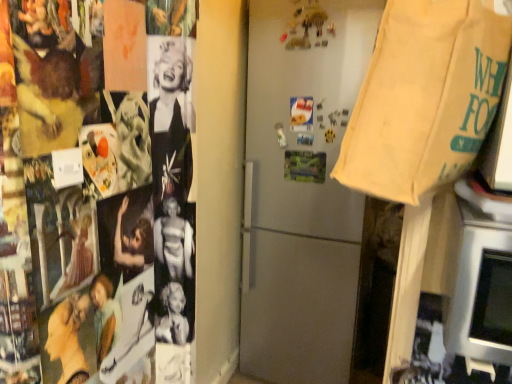
This screenshot has height=384, width=512. Describe the element at coordinates (425, 97) in the screenshot. I see `beige canvas grocery bag at upper right` at that location.

The image size is (512, 384). What do you see at coordinates (302, 194) in the screenshot? I see `satin silver refrigerator at center` at bounding box center [302, 194].

Find the location of a particular element. Image resolution: width=512 pixels, height=384 pixels. satin silver refrigerator at center is located at coordinates (302, 194).

You are a GUI agent. You are given a task and a screenshot of the screen. Output one action in this format:
    pyautogui.click(x=<x>, y=<y>)
    Task: Click on the beige canvas grocery bag at upper right
    
    Given the screenshot: What is the action you would take?
    pyautogui.click(x=425, y=97)

Who is more distant, satin silver refrigerator at center or silver metallic oven at lower right?

satin silver refrigerator at center is further from the camera.

From a real-world perspective, who is located higher, satin silver refrigerator at center or silver metallic oven at lower right?

From a 3D spatial view, silver metallic oven at lower right is above.

Is satin silver refrigerator at center positioned far away from silver metallic oven at lower right?

Yes, satin silver refrigerator at center is far from silver metallic oven at lower right.

From the image's perspective, is satin silver refrigerator at center located above or below silver metallic oven at lower right?

satin silver refrigerator at center is above silver metallic oven at lower right.

Find the location of `grocery bag on the right side of satin silver refrigerator at center`. grocery bag on the right side of satin silver refrigerator at center is located at coordinates (425, 97).

Is satin silver refrigerator at center positioned with its back to beige canvas grocery bag at upper right?

No, beige canvas grocery bag at upper right is not at the back of satin silver refrigerator at center.

From the image's perspective, is satin silver refrigerator at center positioned above or below beige canvas grocery bag at upper right?

From the image's perspective, satin silver refrigerator at center appears below beige canvas grocery bag at upper right.

Is satin silver refrigerator at center wider than beige canvas grocery bag at upper right?

Yes.

Is point (428, 75) less distant than point (334, 54)?

That is True.

Considering the relative positions of beige canvas grocery bag at upper right and satin silver refrigerator at center in the image provided, is beige canvas grocery bag at upper right to the left or to the right of satin silver refrigerator at center?

Based on their positions, beige canvas grocery bag at upper right is located to the right of satin silver refrigerator at center.

Is beige canvas grocery bag at upper right oriented away from satin silver refrigerator at center?

That's right, beige canvas grocery bag at upper right is facing away from satin silver refrigerator at center.

The height and width of the screenshot is (384, 512). Identify the location of grocery bag in front of the satin silver refrigerator at center. (425, 97).

Is silver metallic oven at lower right at the right side of beige canvas grocery bag at upper right?

Yes.

Is silver metallic oven at lower right smaller than beige canvas grocery bag at upper right?

Correct, silver metallic oven at lower right occupies less space than beige canvas grocery bag at upper right.

Based on the photo, from the image's perspective, is silver metallic oven at lower right beneath beige canvas grocery bag at upper right?

Yes, from the image's perspective, silver metallic oven at lower right is beneath beige canvas grocery bag at upper right.

Looking at the image, does silver metallic oven at lower right seem bigger or smaller compared to satin silver refrigerator at center?

Considering their sizes, silver metallic oven at lower right takes up less space than satin silver refrigerator at center.

Does silver metallic oven at lower right appear on the left side of satin silver refrigerator at center?

No.

From the image's perspective, does silver metallic oven at lower right appear higher than satin silver refrigerator at center?

No.

Is beige canvas grocery bag at upper right bigger or smaller than silver metallic oven at lower right?

Clearly, beige canvas grocery bag at upper right is larger in size than silver metallic oven at lower right.

From the image's perspective, does beige canvas grocery bag at upper right appear lower than silver metallic oven at lower right?

No, from the image's perspective, beige canvas grocery bag at upper right is not beneath silver metallic oven at lower right.

Is beige canvas grocery bag at upper right with silver metallic oven at lower right?

beige canvas grocery bag at upper right and silver metallic oven at lower right are not in contact.

What are the coordinates of `oven lying in front of the satin silver refrigerator at center` in the screenshot? It's located at (481, 297).

Find the location of `refrigerator lying behind the beige canvas grocery bag at upper right`. refrigerator lying behind the beige canvas grocery bag at upper right is located at coordinates (302, 194).

Estimate the real-world distances between objects in this image. Which object is closer to satin silver refrigerator at center, beige canvas grocery bag at upper right or silver metallic oven at lower right?

beige canvas grocery bag at upper right lies closer to satin silver refrigerator at center than the other object.

From the image, which object appears to be nearer to beige canvas grocery bag at upper right, silver metallic oven at lower right or satin silver refrigerator at center?

The object closer to beige canvas grocery bag at upper right is silver metallic oven at lower right.

From the picture: Estimate the real-world distances between objects in this image. Which object is closer to beige canvas grocery bag at upper right, satin silver refrigerator at center or silver metallic oven at lower right?

Among the two, silver metallic oven at lower right is located nearer to beige canvas grocery bag at upper right.

Which object lies nearer to the anchor point satin silver refrigerator at center, silver metallic oven at lower right or beige canvas grocery bag at upper right?

beige canvas grocery bag at upper right is positioned closer to the anchor satin silver refrigerator at center.

In the scene shown: When comparing their distances from silver metallic oven at lower right, does beige canvas grocery bag at upper right or satin silver refrigerator at center seem further?

Based on the image, satin silver refrigerator at center appears to be further to silver metallic oven at lower right.

From the image, which object appears to be farther from silver metallic oven at lower right, satin silver refrigerator at center or beige canvas grocery bag at upper right?

satin silver refrigerator at center lies further to silver metallic oven at lower right than the other object.

Where is `oven between beige canvas grocery bag at upper right and satin silver refrigerator at center from front to back`? oven between beige canvas grocery bag at upper right and satin silver refrigerator at center from front to back is located at coordinates (481, 297).